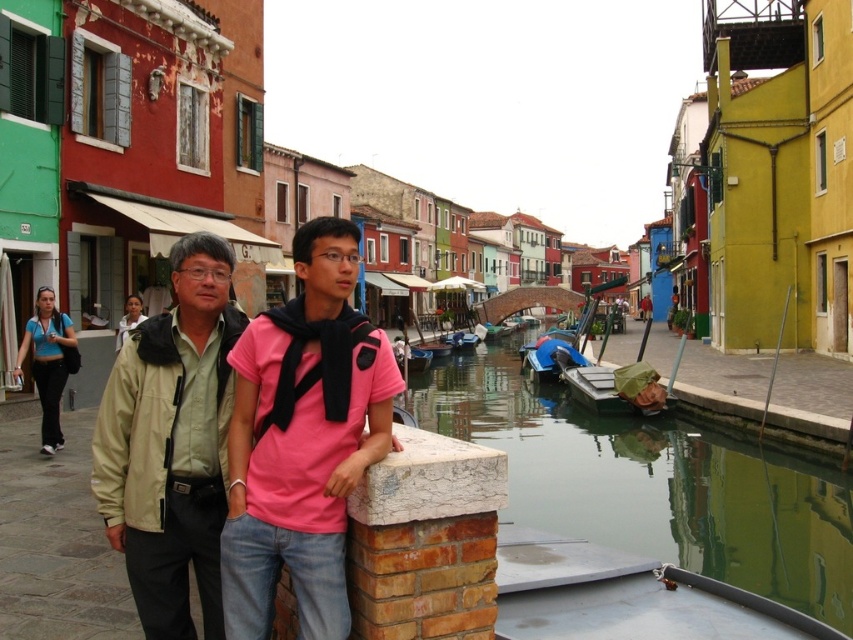
Question: Which is nearer to the white fabric shirt at left?

Choices:
 (A) metallic silver boat at lower right
 (B) matte beige jacket at left
 (C) beige fabric jacket at center

Answer: (C)

Question: Among these objects, which one is farthest from the camera?

Choices:
 (A) blue athletic wear at left
 (B) white fabric shirt at left
 (C) green canvas boat at center

Answer: (C)

Question: Does matte beige jacket at left appear under green reflective water at lower center?

Choices:
 (A) yes
 (B) no

Answer: (B)

Question: Considering the relative positions of beige fabric jacket at center and metallic silver boat at lower right in the image provided, where is beige fabric jacket at center located with respect to metallic silver boat at lower right?

Choices:
 (A) above
 (B) below

Answer: (A)

Question: Which of the following is the closest to the observer?

Choices:
 (A) (221, 376)
 (B) (604, 396)
 (C) (36, 346)
 (D) (453, 387)

Answer: (A)

Question: Is metallic silver boat at lower right further to camera compared to white fabric shirt at left?

Choices:
 (A) no
 (B) yes

Answer: (A)